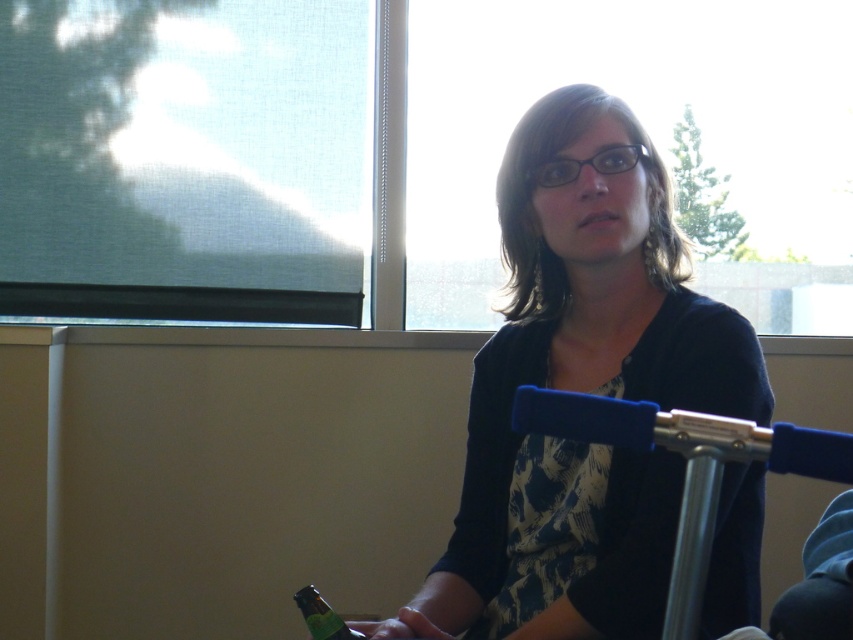
Between matte black sweater at center and green matte bottle at lower left, which one appears on the right side from the viewer's perspective?

Positioned to the right is matte black sweater at center.

Is the position of matte black sweater at center more distant than that of green matte bottle at lower left?

No.

Who is more forward, (503, 628) or (328, 612)?

Positioned in front is point (328, 612).

Find the location of a particular element. This screenshot has width=853, height=640. matte black sweater at center is located at coordinates (581, 392).